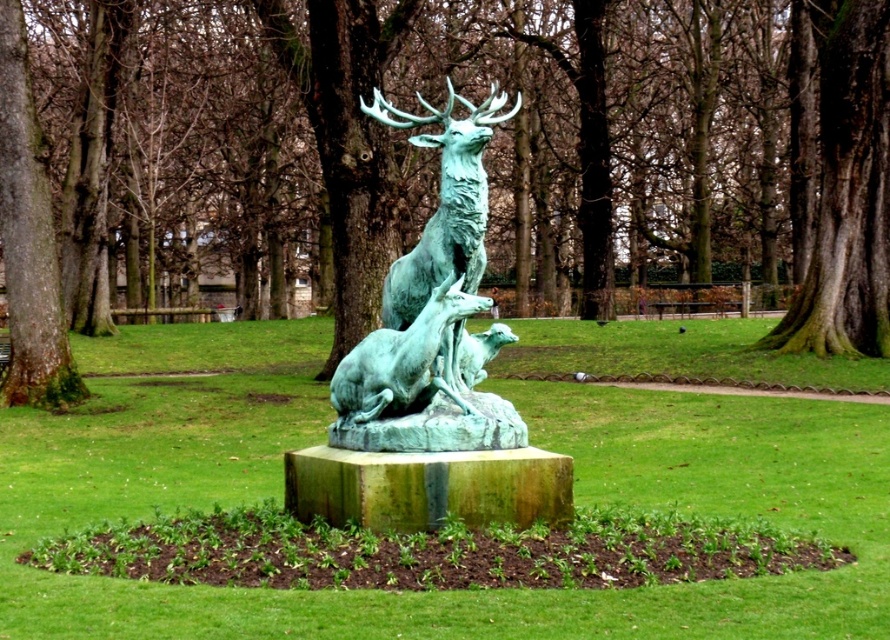
You are a photographer standing in front of the bronze sculpture in the park. You want to take a photo that includes both the point at location (840, 156) and the point at (365, 401). Which point should you focus on first to ensure both are in sharp focus?

You should focus on point (365, 401) first because it is closer to the camera than point (840, 156). By focusing on the closer point, the further point will also be within the depth of field, ensuring both are in sharp focus.

You are a park maintenance worker needing to place a protective covering over the dark brown textured bark at center right and the green patinated bronze deer at center. If the covering material you have is only 1.2 meters wide, can it cover both objects simultaneously without overlapping?

The dark brown textured bark at center right might be wider than the green patinated bronze deer at center. Since the covering material is 1.2 meters wide, it depends on the actual width of the bark. If the bark is wider than the deer, and their combined width exceeds 1.2 meters, the material may not cover both without overlapping. However, without exact measurements, it is uncertain.

Based on the photo, you are a park visitor who wants to take a photo of the green patina statue at center. You notice there is a green mossy tree at center in the background. Will the tree block the statue in your photo?

The green mossy tree at center is taller than the green patina statue at center, so the tree will likely block the statue in your photo if positioned behind it.